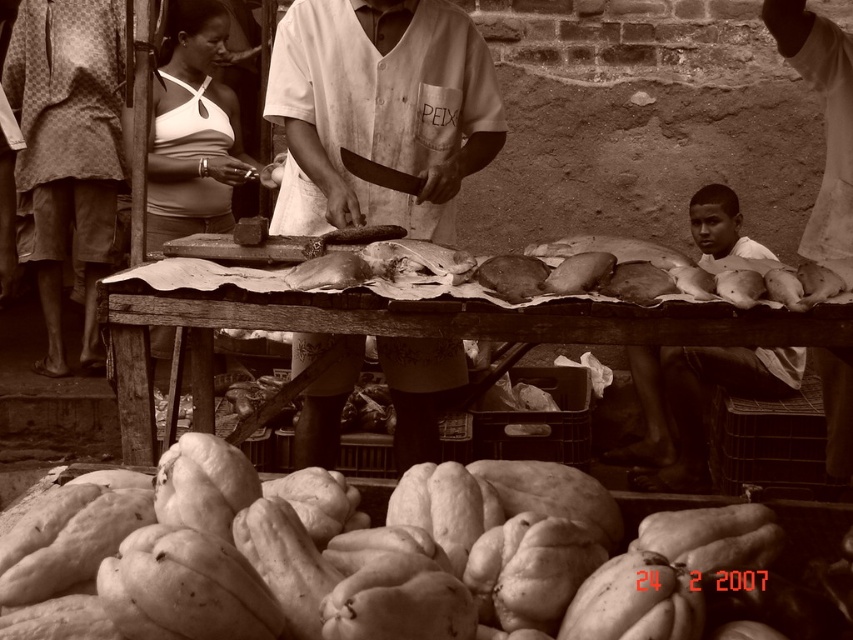
Question: Is wooden table at center above smooth skin boy at center?

Choices:
 (A) yes
 (B) no

Answer: (A)

Question: Does rough textured squash at lower center come in front of wooden table at center?

Choices:
 (A) no
 (B) yes

Answer: (B)

Question: Can you confirm if white fabric shirt at center is positioned below smooth skin boy at center?

Choices:
 (A) no
 (B) yes

Answer: (A)

Question: Which object is farther from the camera taking this photo?

Choices:
 (A) rough textured squash at lower center
 (B) smooth skin boy at center
 (C) white fabric shirt at center
 (D) smooth white blouse at upper left

Answer: (D)

Question: Which point is closer to the camera?

Choices:
 (A) patterned fabric shorts at left
 (B) rough textured squash at lower center
 (C) white fabric shirt at center
 (D) smooth skin boy at center

Answer: (B)

Question: Which object appears closest to the camera in this image?

Choices:
 (A) rough textured squash at lower center
 (B) patterned fabric shorts at left
 (C) smooth white blouse at upper left

Answer: (A)